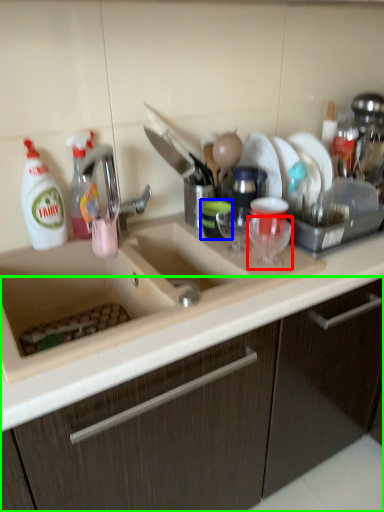
Question: Which object is the closest to the tableware (highlighted by a red box)? Choose among these: tableware (highlighted by a blue box) or cabinetry (highlighted by a green box).

Choices:
 (A) tableware
 (B) cabinetry

Answer: (A)